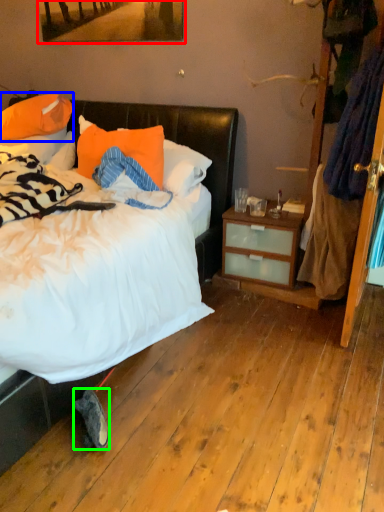
Question: Based on their relative distances, which object is farther from picture frame (highlighted by a red box)? Choose from pillow (highlighted by a blue box) and sneakers (highlighted by a green box).

Choices:
 (A) pillow
 (B) sneakers

Answer: (B)